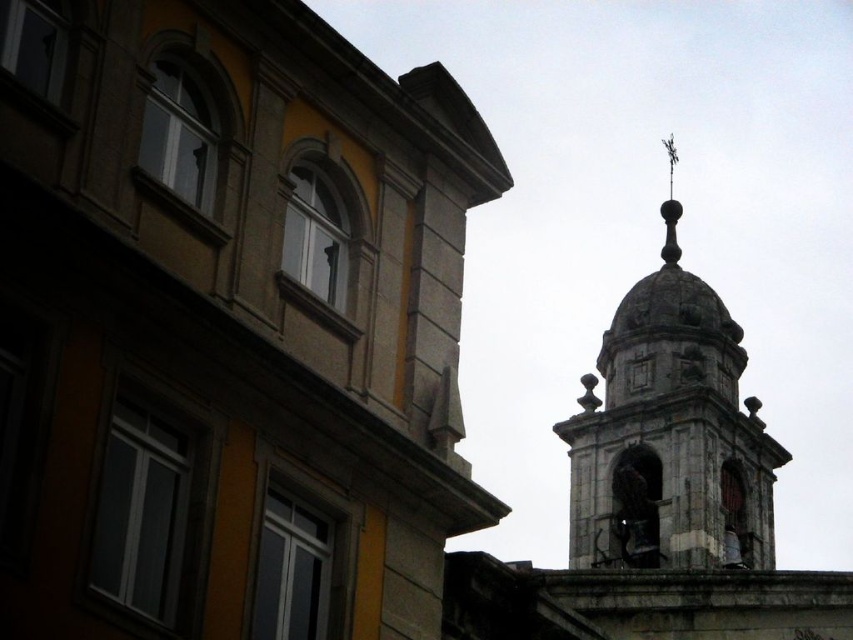
Can you confirm if dark gray stone bell tower at upper right is bigger than polished metal spire at upper center?

Yes, dark gray stone bell tower at upper right is bigger than polished metal spire at upper center.

This screenshot has width=853, height=640. I want to click on dark gray stone bell tower at upper right, so click(670, 440).